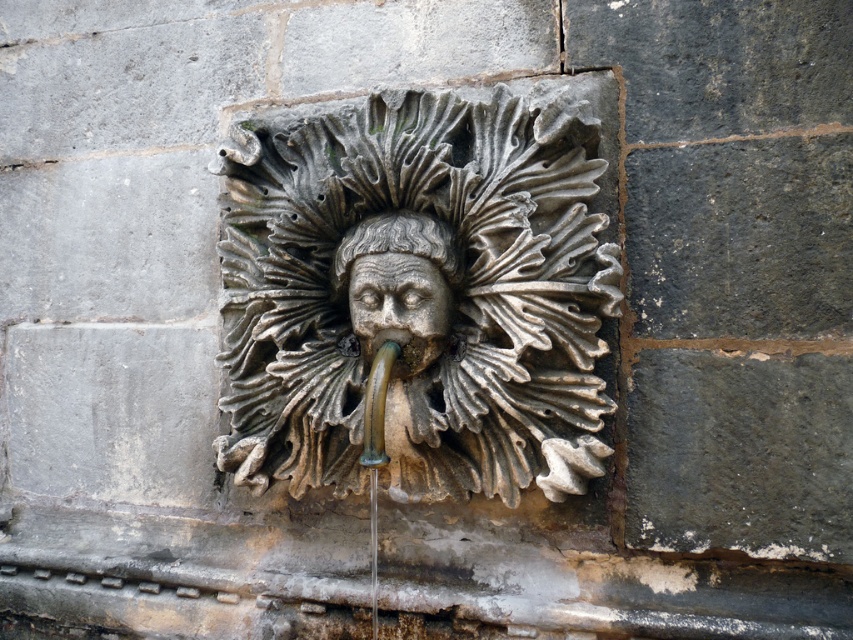
Question: Among these objects, which one is farthest from the camera?

Choices:
 (A) gray stone mask at center
 (B) gray stone face at center

Answer: (B)

Question: Is gray stone mask at center positioned at the back of gray stone face at center?

Choices:
 (A) no
 (B) yes

Answer: (A)

Question: Is gray stone mask at center to the left of gray stone face at center from the viewer's perspective?

Choices:
 (A) yes
 (B) no

Answer: (A)

Question: Which of the following is the closest to the observer?

Choices:
 (A) (376, 348)
 (B) (233, 344)

Answer: (A)

Question: Can you confirm if gray stone mask at center is positioned below gray stone face at center?

Choices:
 (A) no
 (B) yes

Answer: (A)